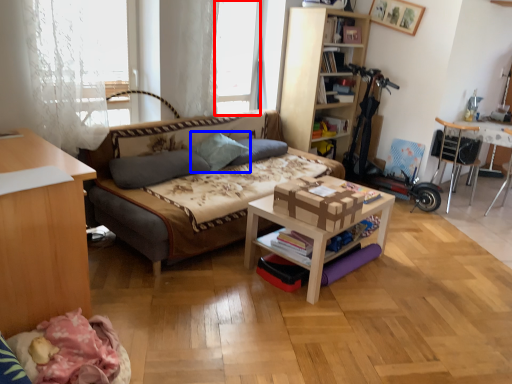
Question: Which object is further to the camera taking this photo, window screen (highlighted by a red box) or pillow (highlighted by a blue box)?

Choices:
 (A) window screen
 (B) pillow

Answer: (A)